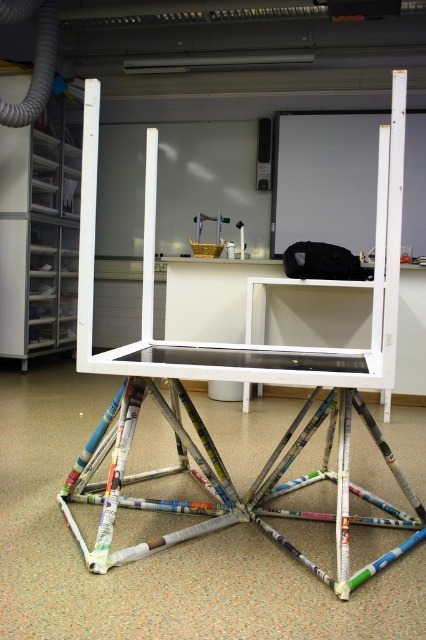
You are an artist trying to place a sculpture on the white glossy table at center. However, there is a white matte ladder at center in the way. Can you move the ladder to access the table?

The white glossy table at center is below the white matte ladder at center, so you can move the ladder aside to access the table since it is positioned above it.

Consider the image. You are an artist standing in the studio and want to place a sculpture on the white painted wood table at center and the white matte ladder at center. Which object is closer to you so you can place the sculpture first?

The white painted wood table at center is closer to you than the white matte ladder at center, so you can place the sculpture on the white painted wood table at center first.